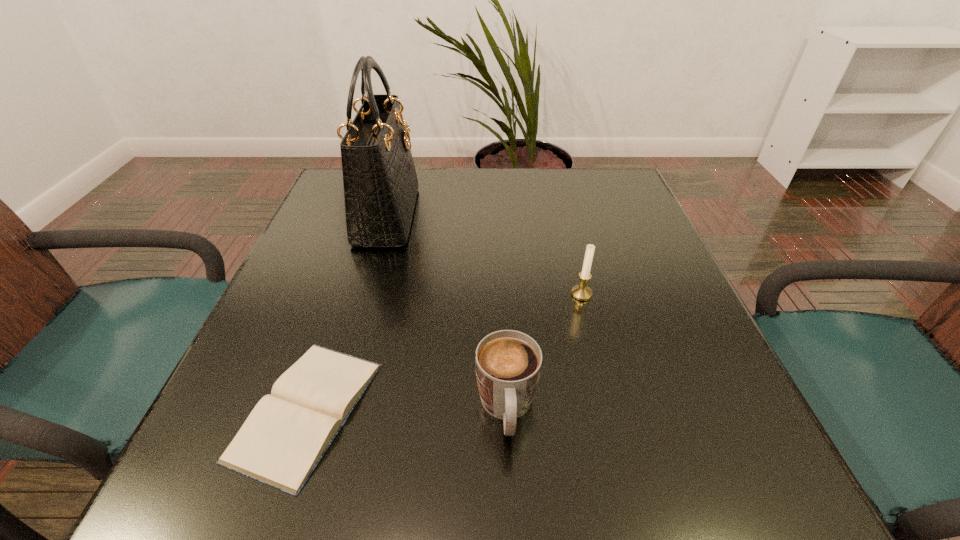
In the image, there is a desktop. What are the coordinates of `vacant space at the right edge` in the screenshot? It's located at (604, 227).

The height and width of the screenshot is (540, 960). I want to click on vacant space at the near left corner of the desktop, so click(171, 495).

Where is `free region at the far right corner of the desktop`? free region at the far right corner of the desktop is located at coordinates (607, 185).

Locate an element on the screen. The image size is (960, 540). vacant space that is in between the second object from right to left and the shortest object is located at coordinates (407, 409).

Find the location of a particular element. free space between the rightmost object and the shortest object is located at coordinates (444, 352).

At what (x,y) coordinates should I click in order to perform the action: click on vacant area between the tallest object and the candle holder. Please return your answer as a coordinate pair (x, y). Looking at the image, I should click on (485, 255).

Locate an element on the screen. This screenshot has width=960, height=540. vacant space that's between the farthest object and the candle holder is located at coordinates (485, 255).

Locate an element on the screen. The height and width of the screenshot is (540, 960). free spot between the Bible and the third nearest object is located at coordinates (444, 352).

I want to click on free area in between the tallest object and the third tallest object, so click(x=447, y=312).

In order to click on vacant space that's between the second object from right to left and the farthest object in this screenshot , I will do `click(447, 312)`.